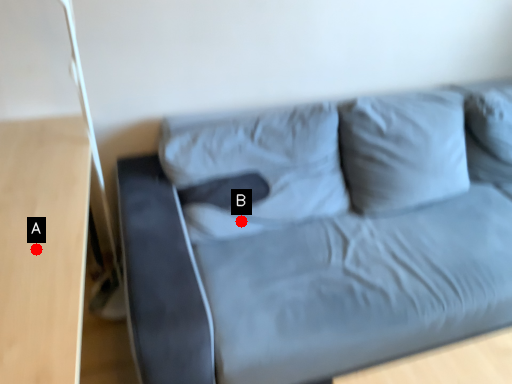
Question: Two points are circled on the image, labeled by A and B beside each circle. Among these points, which one is farthest from the camera?

Choices:
 (A) A is further
 (B) B is further

Answer: (B)